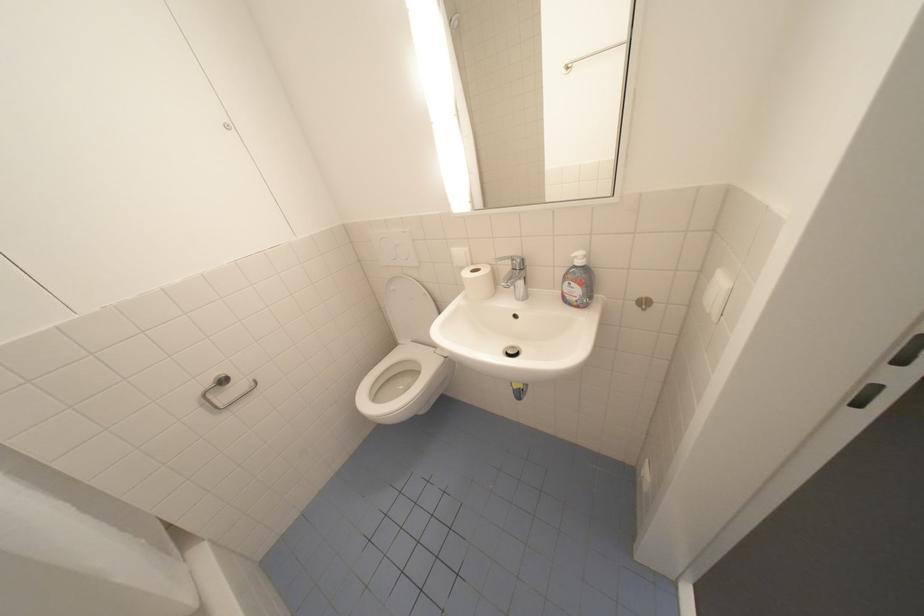
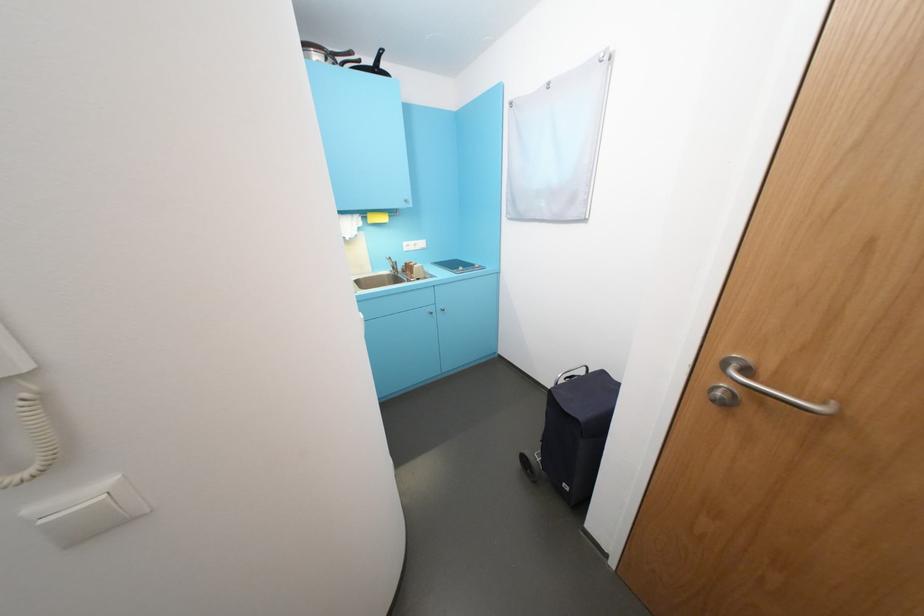
Question: Which direction would the cameraman need to move to produce the second image? Reply with the corresponding letter.

Choices:
 (A) Left
 (B) Right
 (C) Forward
 (D) Backward

Answer: (B)